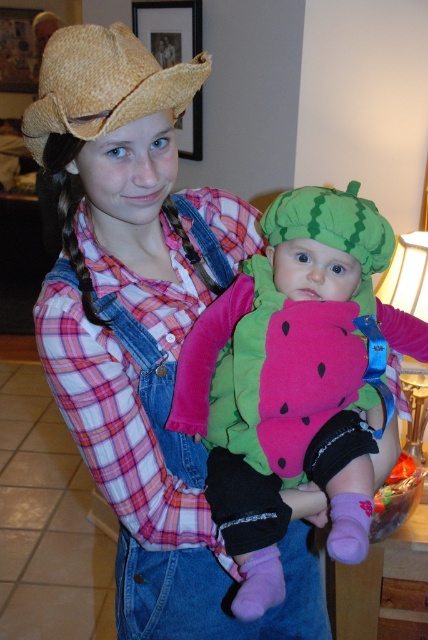
Question: Among these points, which one is nearest to the camera?

Choices:
 (A) (190, 604)
 (B) (157, 100)

Answer: (B)

Question: Does denim overall at center have a larger size compared to straw hat at upper left?

Choices:
 (A) no
 (B) yes

Answer: (B)

Question: Can you confirm if soft pink fabric watermelon at center is bigger than straw hat at upper left?

Choices:
 (A) no
 (B) yes

Answer: (B)

Question: Is the position of denim overall at center more distant than that of soft pink fabric watermelon at center?

Choices:
 (A) no
 (B) yes

Answer: (A)

Question: Estimate the real-world distances between objects in this image. Which object is closer to the soft pink fabric watermelon at center?

Choices:
 (A) straw hat at upper left
 (B) denim overall at center

Answer: (B)

Question: Estimate the real-world distances between objects in this image. Which object is closer to the soft pink fabric watermelon at center?

Choices:
 (A) denim overall at center
 (B) straw hat at upper left

Answer: (A)